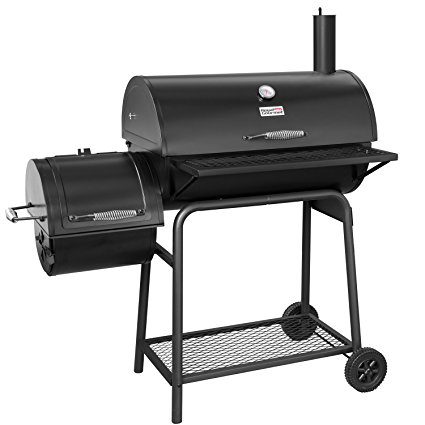
Identify the location of chimney. (326, 22).